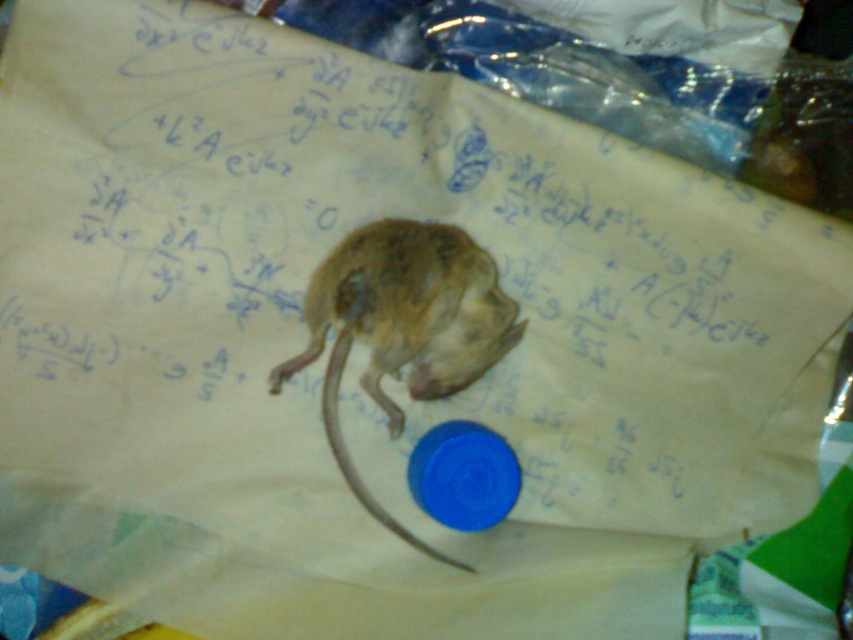
Question: Among these objects, which one is nearest to the camera?

Choices:
 (A) fuzzy brown mouse at center
 (B) brown fur tail at center

Answer: (B)

Question: Among these objects, which one is nearest to the camera?

Choices:
 (A) fuzzy brown mouse at center
 (B) brown fur tail at center

Answer: (B)

Question: Is fuzzy brown mouse at center to the right of brown fur tail at center from the viewer's perspective?

Choices:
 (A) yes
 (B) no

Answer: (A)

Question: Which object appears closest to the camera in this image?

Choices:
 (A) brown fur tail at center
 (B) fuzzy brown mouse at center

Answer: (A)

Question: Is fuzzy brown mouse at center closer to camera compared to brown fur tail at center?

Choices:
 (A) yes
 (B) no

Answer: (B)

Question: Does fuzzy brown mouse at center have a greater width compared to brown fur tail at center?

Choices:
 (A) no
 (B) yes

Answer: (B)